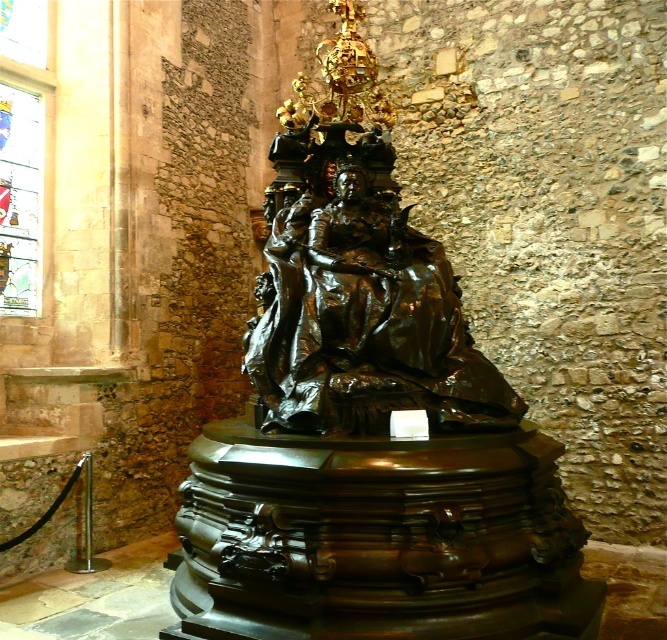
Between bronze statue at center and stained glass window at upper left, which one is positioned higher?

Positioned higher is stained glass window at upper left.

The width and height of the screenshot is (667, 640). Describe the element at coordinates (368, 426) in the screenshot. I see `bronze statue at center` at that location.

Is point (508, 397) less distant than point (21, 244)?

Yes, it is.

At what (x,y) coordinates should I click in order to perform the action: click on bronze statue at center. Please return your answer as a coordinate pair (x, y). The image size is (667, 640). Looking at the image, I should click on (368, 426).

Which is below, shiny bronze statue at center or stained glass window at upper left?

shiny bronze statue at center is lower down.

Where is `shiny bronze statue at center`? The height and width of the screenshot is (640, 667). shiny bronze statue at center is located at coordinates (360, 305).

Can you confirm if bronze statue at center is positioned to the right of shiny bronze statue at center?

Incorrect, bronze statue at center is not on the right side of shiny bronze statue at center.

Does point (289, 336) lie behind point (356, 289)?

No, it is not.

Where is `bronze statue at center`? bronze statue at center is located at coordinates (368, 426).